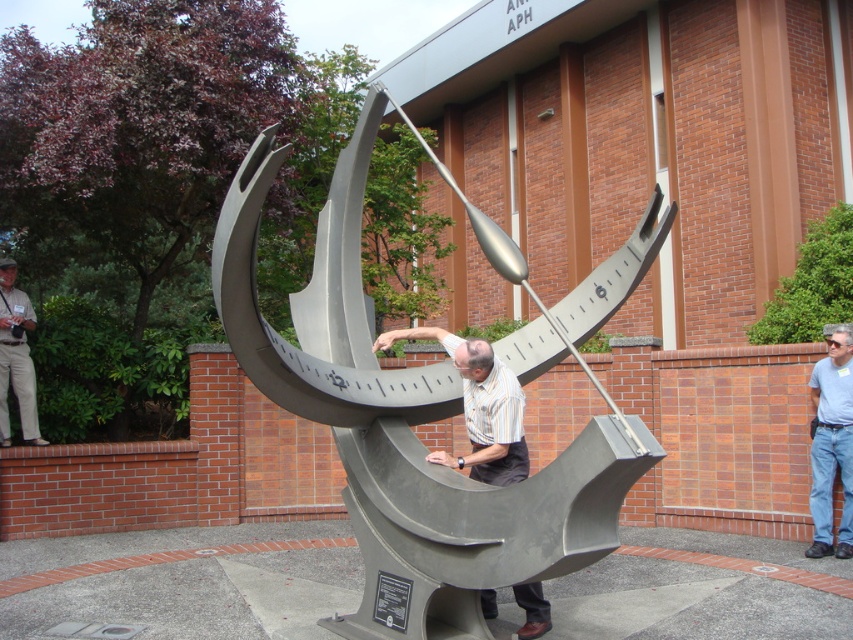
Does gray metallic sculpture at center have a lesser width compared to khaki pants at left?

No, gray metallic sculpture at center is not thinner than khaki pants at left.

Does gray metallic sculpture at center come in front of khaki pants at left?

That is True.

At what (x,y) coordinates should I click in order to perform the action: click on gray metallic sculpture at center. Please return your answer as a coordinate pair (x, y). The image size is (853, 640). Looking at the image, I should click on (479, 406).

Is metallic gray sundial at center below gray metallic sculpture at center?

Actually, metallic gray sundial at center is above gray metallic sculpture at center.

Measure the distance between point (334, 244) and camera.

They are 5.84 meters apart.

Is point (416, 417) in front of point (480, 456)?

No, (416, 417) is behind (480, 456).

At what (x,y) coordinates should I click in order to perform the action: click on metallic gray sundial at center. Please return your answer as a coordinate pair (x, y). This screenshot has width=853, height=640. Looking at the image, I should click on (405, 428).

Between metallic gray sundial at center and light blue shirt at center, which one is positioned higher?

metallic gray sundial at center

Which is in front, point (349, 378) or point (830, 534)?

Positioned in front is point (349, 378).

This screenshot has height=640, width=853. Find the location of `metallic gray sundial at center`. metallic gray sundial at center is located at coordinates (405, 428).